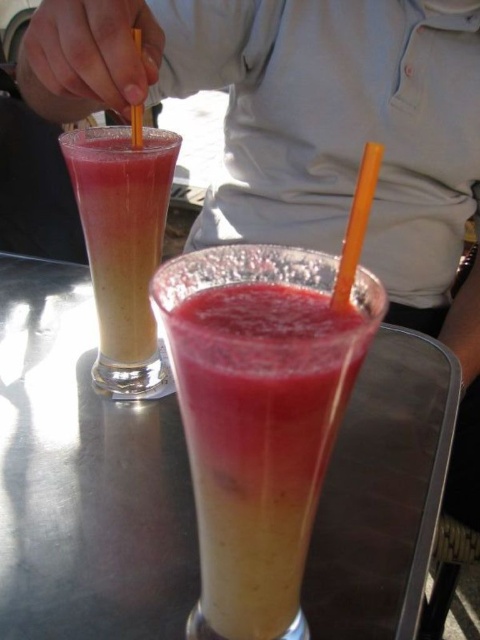
You are a bartender preparing a drink and need to place a garnish exactly at the center of the smooth matte juice at center. Using the coordinate system provided, where the bottom left corner of the image is the origin, what are the coordinates where you should place the garnish?

The coordinates for the center of the smooth matte juice at center are at point (x=260, y=438).